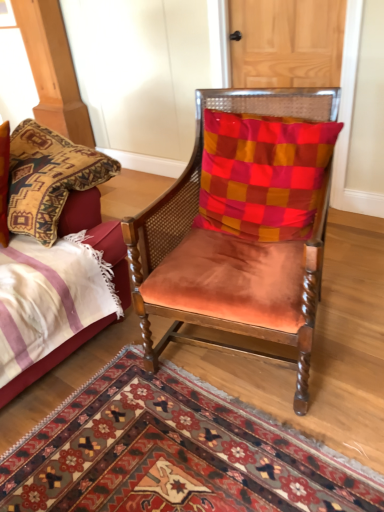
Describe the element at coordinates (174, 453) in the screenshot. This screenshot has height=512, width=384. I see `carpet with intricate patterns at center` at that location.

Where is `wooden door at upper center`? wooden door at upper center is located at coordinates (286, 42).

Locate an element on the screen. velvet bed at left is located at coordinates (56, 258).

This screenshot has width=384, height=512. Identify the location of chair that is above the carpet with intricate patterns at center (from the image's perspective). (231, 252).

Looking at their sizes, would you say suede orange chair at center is wider or thinner than carpet with intricate patterns at center?

In the image, suede orange chair at center appears to be more narrow than carpet with intricate patterns at center.

Is carpet with intricate patterns at center located within suede orange chair at center?

No, carpet with intricate patterns at center is not a part of suede orange chair at center.

Can you confirm if suede orange chair at center is positioned to the left of carpet with intricate patterns at center?

No.

Can you confirm if suede orange chair at center is thinner than velvet bed at left?

Indeed, suede orange chair at center has a lesser width compared to velvet bed at left.

Considering the relative positions of suede orange chair at center and velvet bed at left in the image provided, is suede orange chair at center to the right of velvet bed at left from the viewer's perspective?

Yes, suede orange chair at center is to the right of velvet bed at left.

Where is `bed below the suede orange chair at center (from a real-world perspective)`? The image size is (384, 512). bed below the suede orange chair at center (from a real-world perspective) is located at coordinates 56,258.

From the image's perspective, which one is positioned higher, suede orange chair at center or velvet bed at left?

suede orange chair at center appears higher in the image.

Which is less distant, (279, 224) or (159, 479)?

Point (279, 224).

Is checkered fabric pillow at center turned away from carpet with intricate patterns at center?

checkered fabric pillow at center is not turned away from carpet with intricate patterns at center.

How different are the orientations of checkered fabric pillow at center and carpet with intricate patterns at center in degrees?

They differ by 101 degrees in their facing directions.

Does checkered fabric pillow at center appear on the right side of carpet with intricate patterns at center?

Indeed, checkered fabric pillow at center is positioned on the right side of carpet with intricate patterns at center.

Is the position of carpet with intricate patterns at center less distant than that of wooden door at upper center?

Yes, it is.

Are carpet with intricate patterns at center and wooden door at upper center making contact?

carpet with intricate patterns at center and wooden door at upper center are clearly separated.

Who is bigger, carpet with intricate patterns at center or wooden door at upper center?

With larger size is wooden door at upper center.

From the image's perspective, which object appears higher, carpet with intricate patterns at center or wooden door at upper center?

wooden door at upper center, from the image's perspective.

Looking at the image, does wooden door at upper center seem bigger or smaller compared to checkered fabric pillow at center?

Considering their sizes, wooden door at upper center takes up less space than checkered fabric pillow at center.

From the image's perspective, who appears lower, wooden door at upper center or checkered fabric pillow at center?

checkered fabric pillow at center appears lower in the image.

Considering the positions of objects wooden door at upper center and checkered fabric pillow at center in the image provided, who is more to the right, wooden door at upper center or checkered fabric pillow at center?

wooden door at upper center.

Identify the location of chair on the left of checkered fabric pillow at center. (231, 252).

Is suede orange chair at center looking in the opposite direction of checkered fabric pillow at center?

Yes, suede orange chair at center is facing away from checkered fabric pillow at center.

From a real-world perspective, who is located lower, suede orange chair at center or checkered fabric pillow at center?

In real-world perspective, suede orange chair at center is lower.

Considering the sizes of objects suede orange chair at center and checkered fabric pillow at center in the image provided, who is smaller, suede orange chair at center or checkered fabric pillow at center?

checkered fabric pillow at center is smaller.

Is checkered fabric pillow at center facing towards velvet bed at left?

No, checkered fabric pillow at center is not turned towards velvet bed at left.

Would you say velvet bed at left is part of checkered fabric pillow at center's contents?

No, velvet bed at left is not a part of checkered fabric pillow at center.

Considering the relative positions of checkered fabric pillow at center and velvet bed at left in the image provided, is checkered fabric pillow at center to the left or to the right of velvet bed at left?

In the image, checkered fabric pillow at center appears on the right side of velvet bed at left.

Which of these two, checkered fabric pillow at center or velvet bed at left, stands taller?

Standing taller between the two is velvet bed at left.

Locate an element on the screen. This screenshot has height=512, width=384. chair that is above the carpet with intricate patterns at center (from the image's perspective) is located at coordinates (231, 252).

Image resolution: width=384 pixels, height=512 pixels. What are the coordinates of `bed behind the suede orange chair at center` in the screenshot? It's located at (56, 258).

Which object lies further to the anchor point checkered fabric pillow at center, suede orange chair at center or wooden door at upper center?

wooden door at upper center.

Consider the image. Looking at the image, which one is located closer to carpet with intricate patterns at center, wooden door at upper center or suede orange chair at center?

suede orange chair at center.

From the image, which object appears to be farther from carpet with intricate patterns at center, suede orange chair at center or wooden door at upper center?

wooden door at upper center lies further to carpet with intricate patterns at center than the other object.

Which object lies nearer to the anchor point suede orange chair at center, velvet bed at left or carpet with intricate patterns at center?

velvet bed at left.

From the image, which object appears to be nearer to checkered fabric pillow at center, carpet with intricate patterns at center or velvet bed at left?

velvet bed at left.

Looking at the image, which one is located closer to wooden door at upper center, checkered fabric pillow at center or suede orange chair at center?

checkered fabric pillow at center is positioned closer to the anchor wooden door at upper center.

Based on their spatial positions, is wooden door at upper center or checkered fabric pillow at center closer to suede orange chair at center?

checkered fabric pillow at center is closer to suede orange chair at center.

Looking at the image, which one is located further to wooden door at upper center, velvet bed at left or suede orange chair at center?

velvet bed at left.

Find the location of a particular element. This screenshot has width=384, height=512. chair between wooden door at upper center and carpet with intricate patterns at center from top to bottom is located at coordinates (231, 252).

Locate an element on the screen. chair between wooden door at upper center and velvet bed at left from top to bottom is located at coordinates (231, 252).

Locate an element on the screen. The image size is (384, 512). mat situated between velvet bed at left and checkered fabric pillow at center from left to right is located at coordinates (174, 453).

Identify the location of pillow between velvet bed at left and wooden door at upper center. (263, 175).